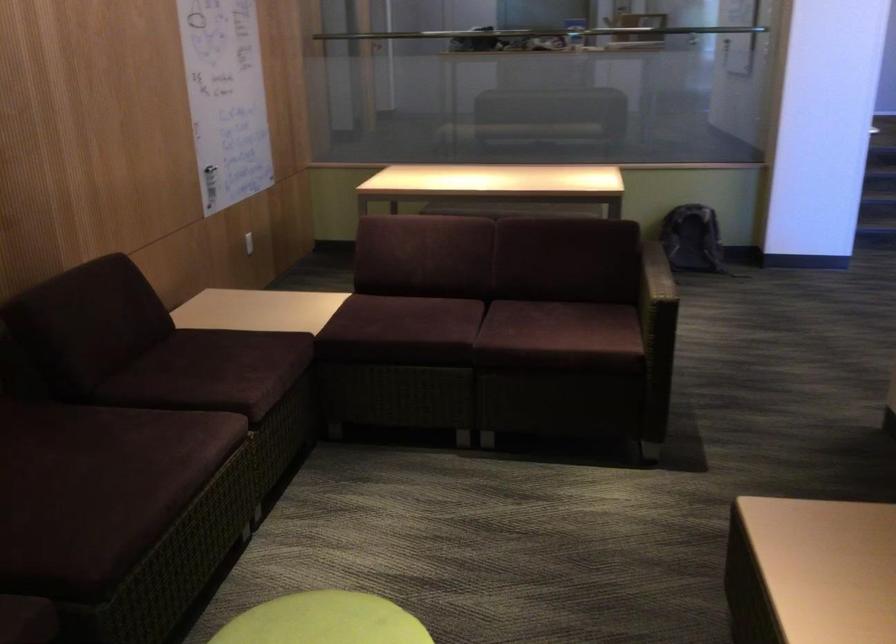
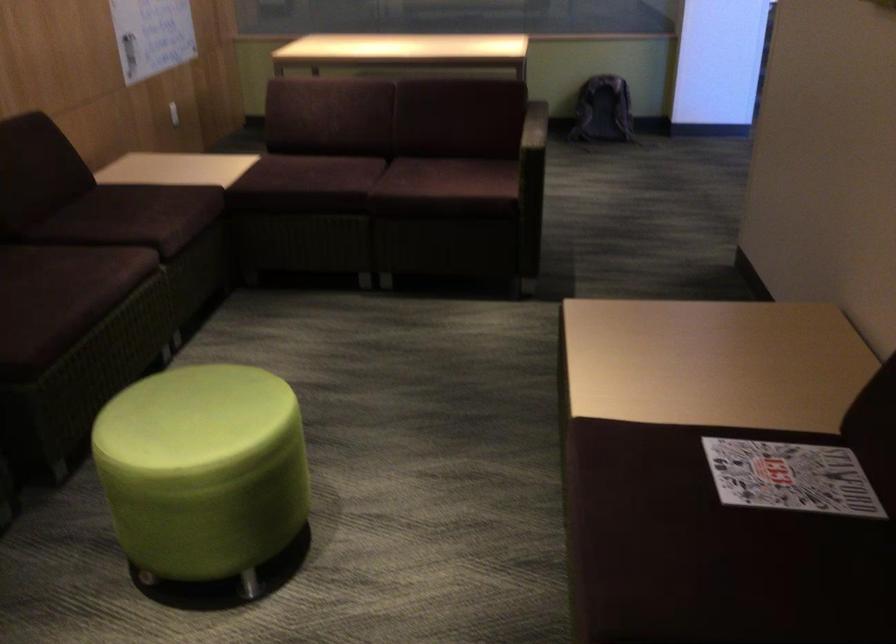
The point at (474, 337) is marked in the first image. Where is the corresponding point in the second image?

(371, 185)